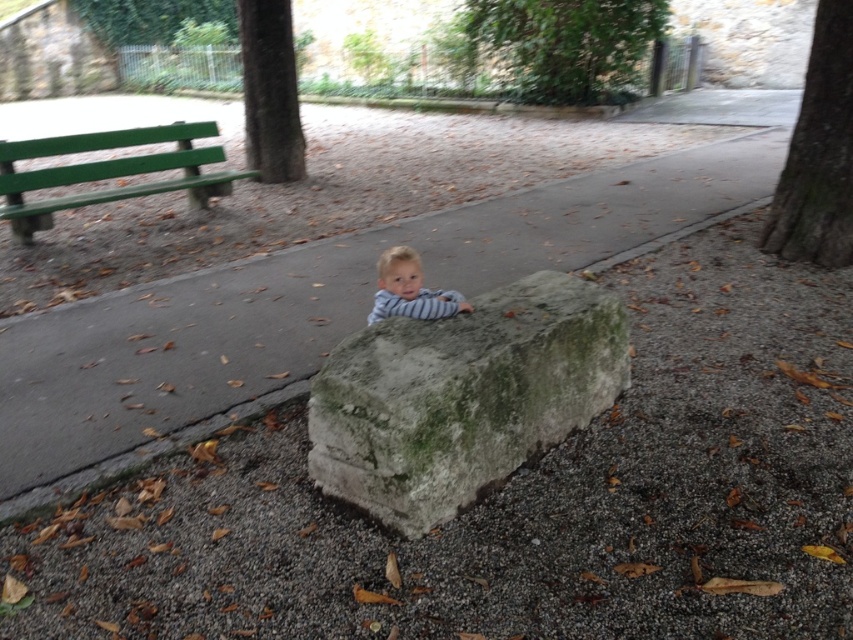
Can you confirm if green mossy stone at center is positioned above striped fabric toddler at center?

Incorrect, green mossy stone at center is not positioned above striped fabric toddler at center.

Who is taller, green mossy stone at center or striped fabric toddler at center?

Standing taller between the two is green mossy stone at center.

Between point (538, 291) and point (395, 248), which one is positioned in front?

Point (538, 291) is more forward.

Image resolution: width=853 pixels, height=640 pixels. I want to click on green mossy stone at center, so click(462, 396).

Between point (554, 99) and point (247, 35), which one is positioned in front?

Point (247, 35)

Is green leafy tree at upper center behind green rough bark tree at upper center?

Yes, green leafy tree at upper center is behind green rough bark tree at upper center.

Between point (544, 68) and point (283, 100), which one is positioned behind?

The point (544, 68) is behind.

Where is `green leafy tree at upper center`? This screenshot has height=640, width=853. green leafy tree at upper center is located at coordinates (556, 45).

Is gray concrete pavement at center above green painted wood bench at left?

Incorrect, gray concrete pavement at center is not positioned above green painted wood bench at left.

Image resolution: width=853 pixels, height=640 pixels. I want to click on gray concrete pavement at center, so click(x=312, y=312).